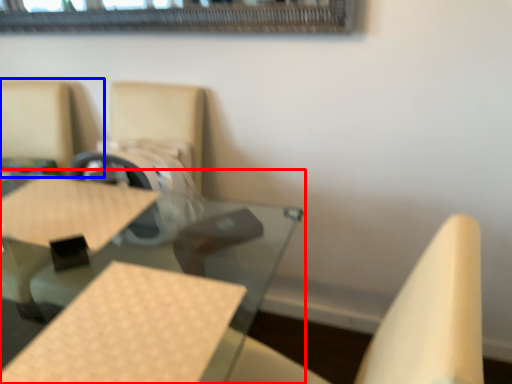
Question: Which of the following is the closest to the observer, table (highlighted by a red box) or chair (highlighted by a blue box)?

Choices:
 (A) table
 (B) chair

Answer: (A)